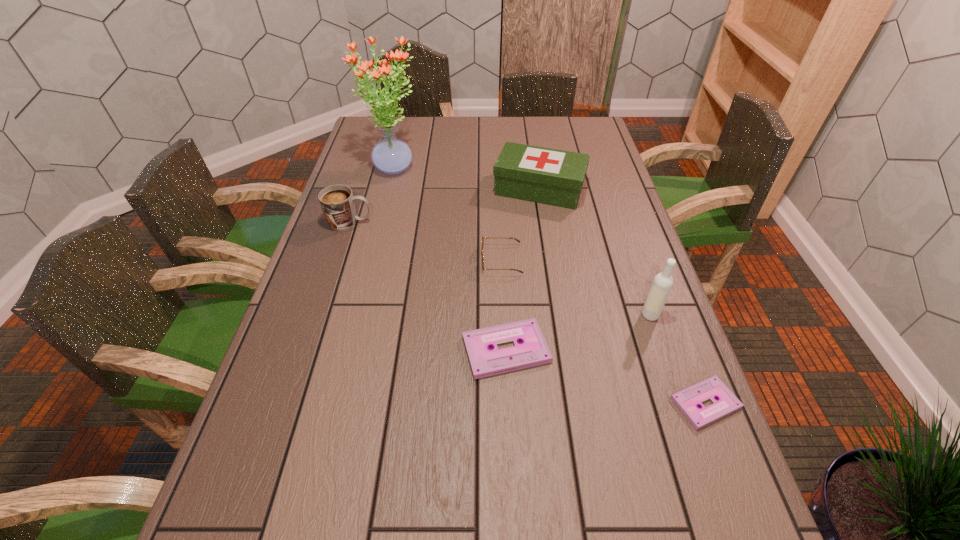
At what (x,y) coordinates should I click in order to perform the action: click on vacant spot to place a videotape on the left. Please return your answer as a coordinate pair (x, y). Image resolution: width=960 pixels, height=540 pixels. Looking at the image, I should click on (341, 306).